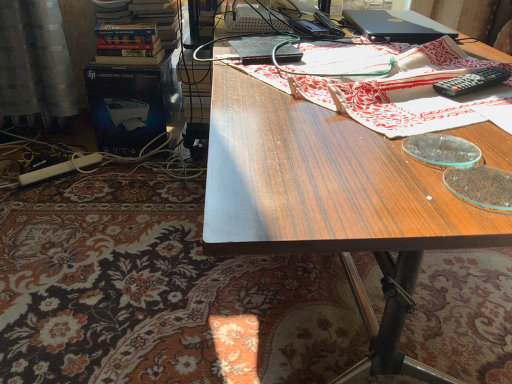
Locate an element on the screen. The width and height of the screenshot is (512, 384). vacant region under black matte laptop at upper right (from a real-world perspective) is located at coordinates coord(397,26).